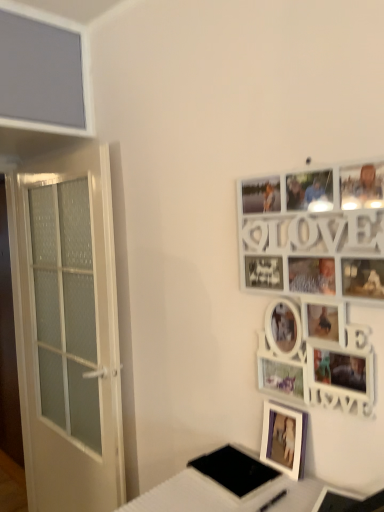
Question: Is purple matte picture frame at lower right, the 1th picture frame from the bottom, situated inside black matte pad at lower center or outside?

Choices:
 (A) inside
 (B) outside

Answer: (B)

Question: In the image, is purple matte picture frame at lower right, the 1th picture frame from the bottom, positioned in front of or behind black matte pad at lower center?

Choices:
 (A) behind
 (B) front

Answer: (A)

Question: Which object is the farthest from the white frosted glass door at left?

Choices:
 (A) white wooden picture frame at upper right, which appears as the second picture frame when ordered from the bottom
 (B) black matte pad at lower center
 (C) white glossy table at lower right
 (D) purple matte picture frame at lower right, which is the 2th picture frame from top to bottom

Answer: (D)

Question: Which object is positioned closest to the white frosted glass door at left?

Choices:
 (A) black matte pad at lower center
 (B) white glossy table at lower right
 (C) white wooden picture frame at upper right, acting as the 1th picture frame starting from the top
 (D) purple matte picture frame at lower right, the 1th picture frame from the bottom

Answer: (B)